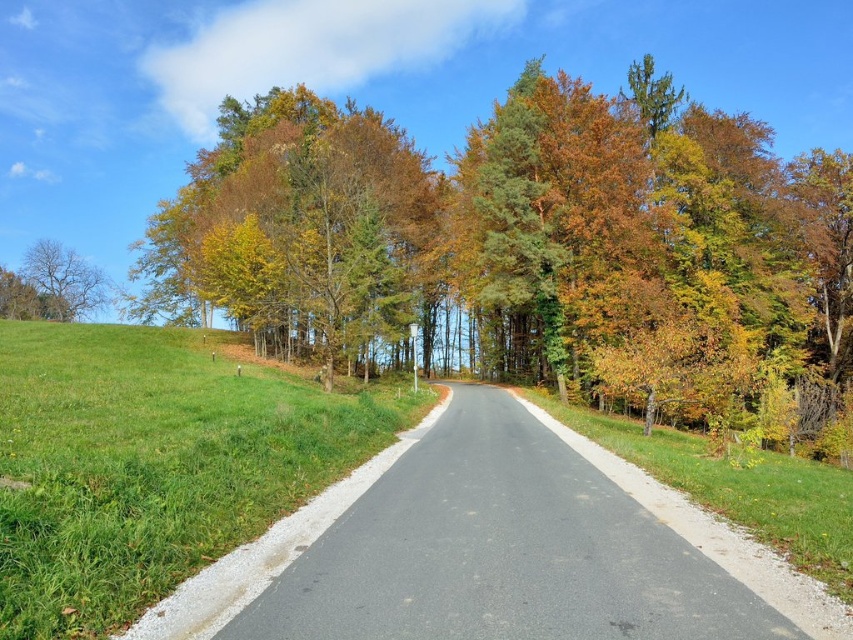
You are standing at the center of the road in the rural landscape. There is a point marked at coordinates (740, 488). Based on the scene description, what is the most likely feature represented by this point?

The point (740, 488) corresponds to the green grass at right, as stated in the Objects Description.

From the picture: You are standing at the point marked by the coordinates point (534, 250). Looking around, you see a paved road with a red line marking its edge. Which direction should you walk to stay on the road?

The point (534, 250) is the green leafy tree at center. To stay on the road, you should walk away from the tree towards the road, which is bordered by a red line marking its edge. Since the road is in the center of the scene, moving towards the road from the tree would keep you on the paved area.

You are standing on the paved road and want to walk to the green grass at right. Which direction should you go to avoid the green leafy tree at center?

To reach the green grass at right while avoiding the green leafy tree at center, you should walk to the right side of the road since the green leafy tree at center is located to the left of the green grass at right.